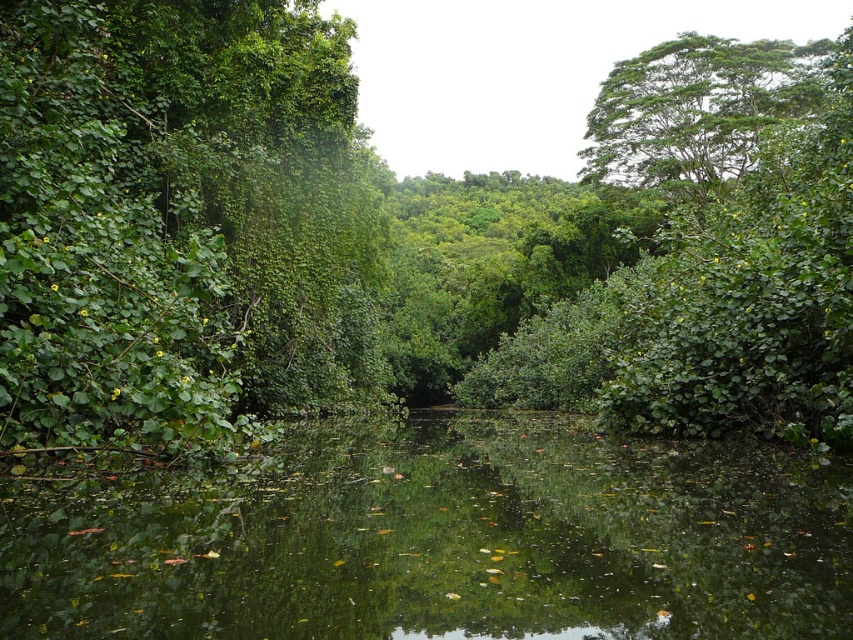
You are standing at the center of the waterway and want to reach the green leafy tree at left. Which direction should you move in to get there?

The green leafy tree at left is located at point 0.358 on the x and 0.213 on the y, so you should move to the left direction to reach it.